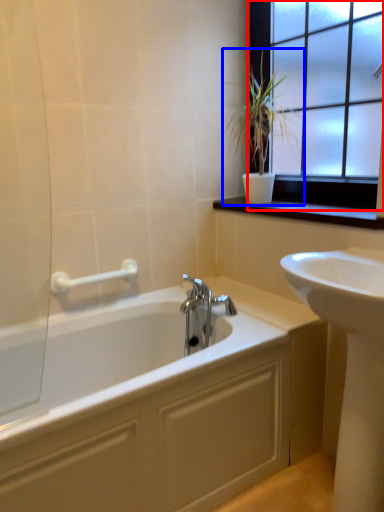
Question: Which point is closer to the camera, window (highlighted by a red box) or houseplant (highlighted by a blue box)?

Choices:
 (A) window
 (B) houseplant

Answer: (A)